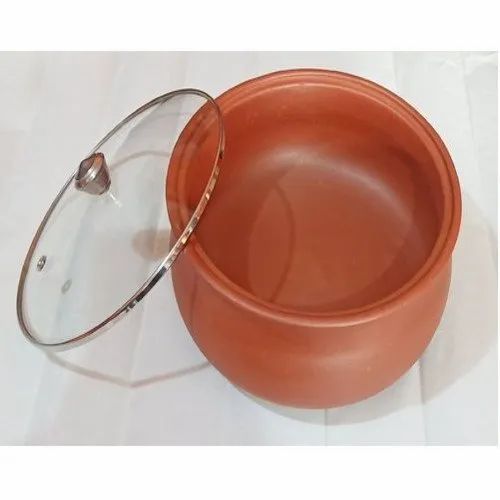
Where is `silver lid knob`? The image size is (500, 500). silver lid knob is located at coordinates click(x=90, y=162).